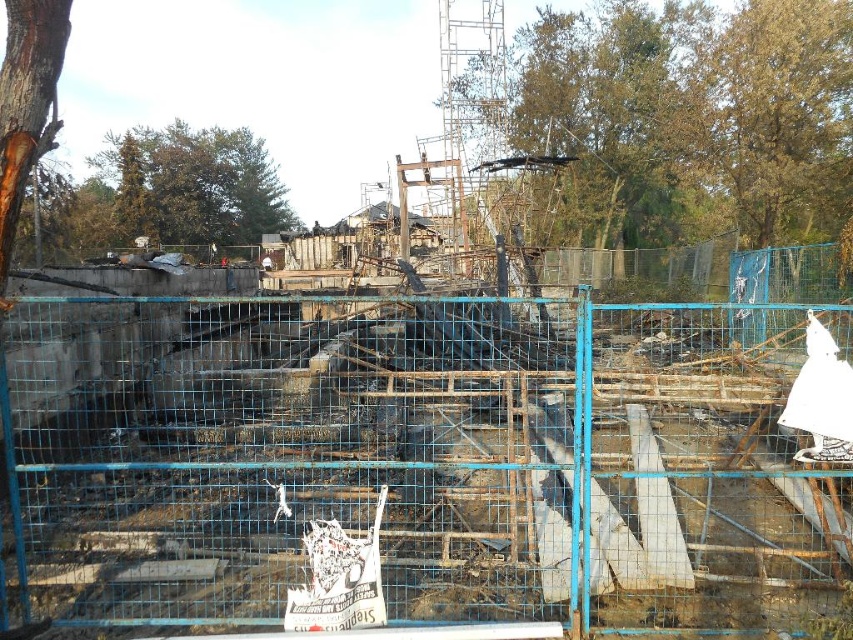
Question: Does green leafy tree at upper center have a larger size compared to green leafy tree at upper left?

Choices:
 (A) no
 (B) yes

Answer: (B)

Question: Does green leafy tree at upper center appear over brown rough bark at left?

Choices:
 (A) no
 (B) yes

Answer: (B)

Question: Which of these objects is positioned farthest from the green leafy tree at upper center?

Choices:
 (A) brown rough bark at left
 (B) green leafy tree at upper left

Answer: (B)

Question: Considering the real-world distances, which object is farthest from the brown rough bark at left?

Choices:
 (A) green leafy tree at upper left
 (B) green leafy tree at upper center

Answer: (A)

Question: Which of the following is the farthest from the observer?

Choices:
 (A) green leafy tree at upper left
 (B) brown rough bark at left
 (C) green leafy tree at upper center

Answer: (A)

Question: Can you confirm if green leafy tree at upper center is bigger than brown rough bark at left?

Choices:
 (A) yes
 (B) no

Answer: (A)